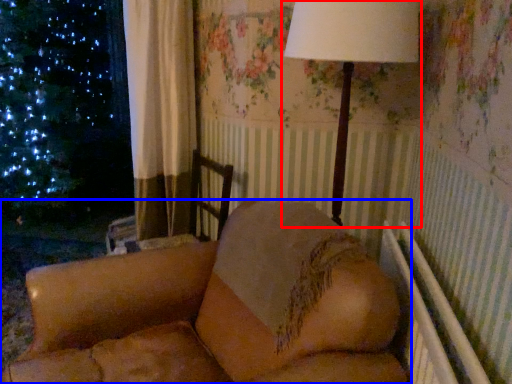
Question: Which of the following is the closest to the observer, lamp (highlighted by a red box) or furniture (highlighted by a blue box)?

Choices:
 (A) lamp
 (B) furniture

Answer: (B)